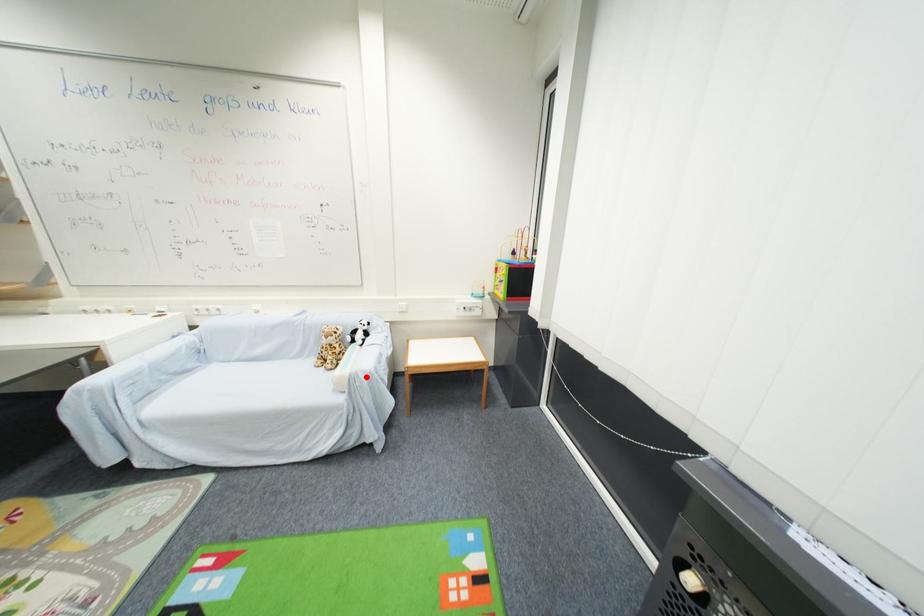
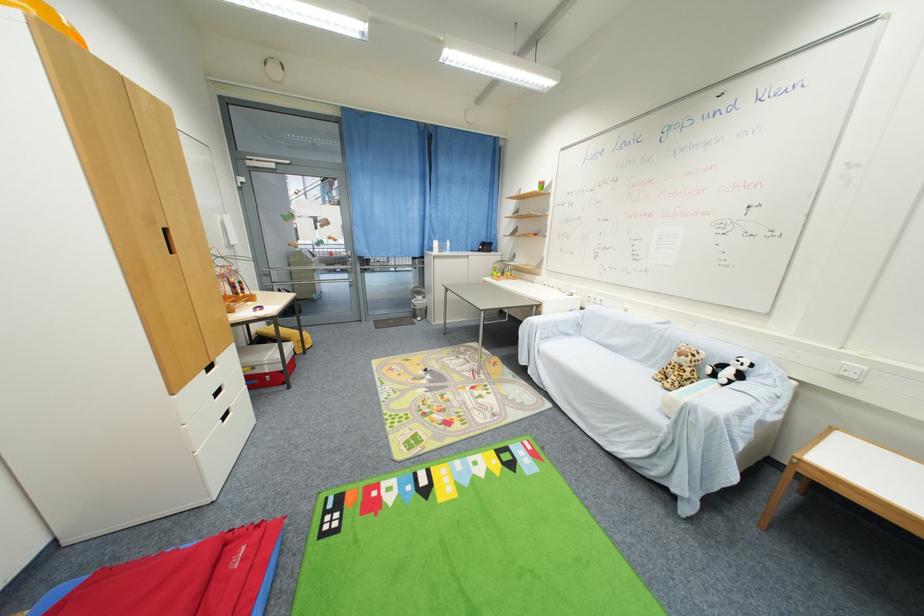
The point at the highlighted location is marked in the first image. Where is the corresponding point in the second image?

(706, 415)